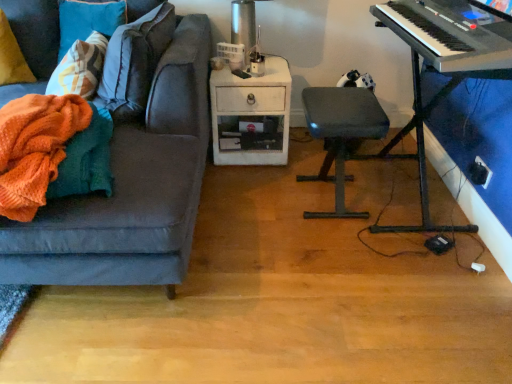
You are a GUI agent. You are given a task and a screenshot of the screen. Output one action in this format:
    pyautogui.click(x=<x>, y=<y>)
    Task: Click on the vacant space in front of white wicker side table at center
    This screenshot has width=512, height=384.
    Given the screenshot: What is the action you would take?
    click(245, 187)